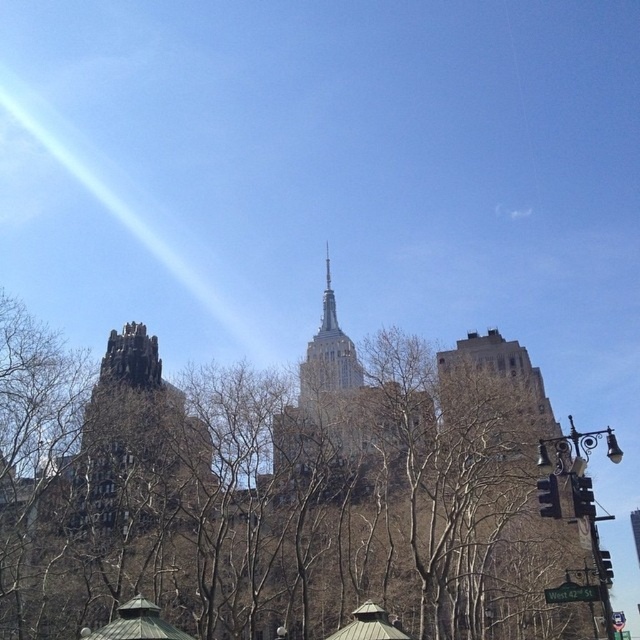
Question: Is brown leafless tree at center smaller than brown stone building at right?

Choices:
 (A) no
 (B) yes

Answer: (A)

Question: Is brown stone building at right above dark gray stone tower at left?

Choices:
 (A) no
 (B) yes

Answer: (A)

Question: Estimate the real-world distances between objects in this image. Which object is closer to the brown stone building at right?

Choices:
 (A) brown leafless tree at center
 (B) dark gray stone tower at left

Answer: (A)

Question: Which point is closer to the camera?

Choices:
 (A) brown leafless tree at center
 (B) brown stone building at right
 (C) dark gray stone tower at left

Answer: (A)

Question: Among these points, which one is nearest to the camera?

Choices:
 (A) (323, 540)
 (B) (508, 570)
 (C) (150, 458)

Answer: (B)

Question: Is brown leafless tree at center below brown stone building at right?

Choices:
 (A) no
 (B) yes

Answer: (A)